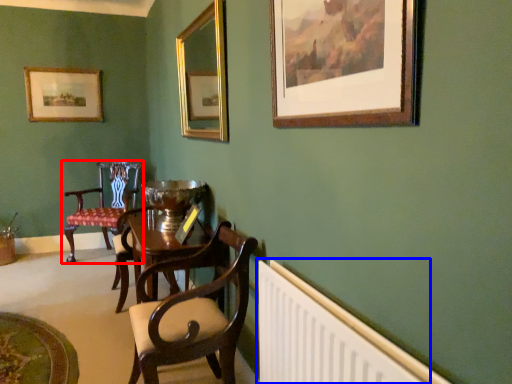
Question: Which point is closer to the camera, chair (highlighted by a red box) or radiator (highlighted by a blue box)?

Choices:
 (A) chair
 (B) radiator

Answer: (B)